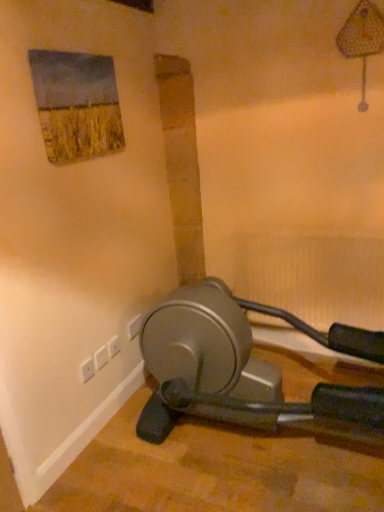
Identify the location of white plastic electric outlet at lower left, which is the first electric outlet in front-to-back order. (x=87, y=370).

Measure the distance between white plastic electric outlet at lower left, which appears as the 3th electric outlet when viewed from the front, and camera.

white plastic electric outlet at lower left, which appears as the 3th electric outlet when viewed from the front, is 2.07 meters from camera.

Locate an element on the screen. white plastic electric outlet at lower left, positioned as the 2th electric outlet in front-to-back order is located at coordinates (114, 346).

From a real-world perspective, is white plastic electric outlet at lower left, acting as the 1th electric outlet starting from the back, positioned above or below white plastic electric outlet at lower left, the first electric outlet when ordered from left to right?

Clearly, from a real-world perspective, white plastic electric outlet at lower left, acting as the 1th electric outlet starting from the back, is below white plastic electric outlet at lower left, the first electric outlet when ordered from left to right.

Are white plastic electric outlet at lower left, arranged as the 3th electric outlet when viewed from the left, and white plastic electric outlet at lower left, the 3th electric outlet positioned from the back, making contact?

No, white plastic electric outlet at lower left, arranged as the 3th electric outlet when viewed from the left, is not touching white plastic electric outlet at lower left, the 3th electric outlet positioned from the back.

Which object is closer to the camera taking this photo, white plastic electric outlet at lower left, arranged as the 3th electric outlet when viewed from the left, or white plastic electric outlet at lower left, the 3th electric outlet positioned from the back?

white plastic electric outlet at lower left, the 3th electric outlet positioned from the back.

Which is more to the right, white plastic electric outlet at lower left, arranged as the 3th electric outlet when viewed from the left, or white plastic electric outlet at lower left, the first electric outlet when ordered from left to right?

From the viewer's perspective, white plastic electric outlet at lower left, arranged as the 3th electric outlet when viewed from the left, appears more on the right side.

From a real-world perspective, who is located higher, white plastic electric outlet at lower left, acting as the 1th electric outlet starting from the back, or white plastic electric outlet at lower left, positioned as the 2th electric outlet in front-to-back order?

white plastic electric outlet at lower left, positioned as the 2th electric outlet in front-to-back order, from a real-world perspective.

Is white plastic electric outlet at lower left, positioned as the 2th electric outlet in front-to-back order, inside white plastic electric outlet at lower left, acting as the 1th electric outlet starting from the back?

That's incorrect, white plastic electric outlet at lower left, positioned as the 2th electric outlet in front-to-back order, is not inside white plastic electric outlet at lower left, acting as the 1th electric outlet starting from the back.

Where is `the 2nd electric outlet directly above the white plastic electric outlet at lower left, which appears as the 3th electric outlet when viewed from the front (from a real-world perspective)`? the 2nd electric outlet directly above the white plastic electric outlet at lower left, which appears as the 3th electric outlet when viewed from the front (from a real-world perspective) is located at coordinates (114, 346).

Considering the sizes of white plastic electric outlet at lower left, acting as the 1th electric outlet starting from the back, and white plastic electric outlet at lower left, marked as the 2th electric outlet in a right-to-left arrangement, in the image, is white plastic electric outlet at lower left, acting as the 1th electric outlet starting from the back, taller or shorter than white plastic electric outlet at lower left, marked as the 2th electric outlet in a right-to-left arrangement,?

Considering their sizes, white plastic electric outlet at lower left, acting as the 1th electric outlet starting from the back, has more height than white plastic electric outlet at lower left, marked as the 2th electric outlet in a right-to-left arrangement.

Who is shorter, white plastic plug at lower left or white plastic electric outlet at lower left, acting as the 1th electric outlet starting from the back?

Standing shorter between the two is white plastic plug at lower left.

Can you tell me how much white plastic plug at lower left and white plastic electric outlet at lower left, acting as the 1th electric outlet starting from the back, differ in facing direction?

The angle between the facing direction of white plastic plug at lower left and the facing direction of white plastic electric outlet at lower left, acting as the 1th electric outlet starting from the back, is 0.0434 degrees.

Is point (99, 350) less distant than point (142, 315)?

Yes, it is in front of point (142, 315).

Could you tell me if white plastic electric outlet at lower left, the second electric outlet in the back-to-front sequence, is turned towards white plastic plug at lower left?

No, white plastic electric outlet at lower left, the second electric outlet in the back-to-front sequence, is not aimed at white plastic plug at lower left.

Find the location of `plug in front of the white plastic electric outlet at lower left, positioned as the 2th electric outlet in front-to-back order`. plug in front of the white plastic electric outlet at lower left, positioned as the 2th electric outlet in front-to-back order is located at coordinates (101, 357).

Who is shorter, white plastic electric outlet at lower left, marked as the 2th electric outlet in a right-to-left arrangement, or white plastic plug at lower left?

white plastic electric outlet at lower left, marked as the 2th electric outlet in a right-to-left arrangement, is shorter.

Which is more to the right, white plastic electric outlet at lower left, positioned as the 2th electric outlet in front-to-back order, or white plastic plug at lower left?

white plastic electric outlet at lower left, positioned as the 2th electric outlet in front-to-back order, is more to the right.

From a real-world perspective, is white plastic electric outlet at lower left, the third electric outlet positioned from the right, positioned under white plastic electric outlet at lower left, arranged as the 1th electric outlet when viewed from the right, based on gravity?

No, from a real-world perspective, white plastic electric outlet at lower left, the third electric outlet positioned from the right, is not beneath white plastic electric outlet at lower left, arranged as the 1th electric outlet when viewed from the right.

Is point (83, 378) closer to viewer compared to point (133, 331)?

That is True.

Is white plastic electric outlet at lower left, the 3th electric outlet positioned from the back, inside the boundaries of white plastic electric outlet at lower left, arranged as the 3th electric outlet when viewed from the left, or outside?

The correct answer is: outside.

Is white plastic plug at lower left further to the viewer compared to white plastic electric outlet at lower left, marked as the 2th electric outlet in a right-to-left arrangement?

That is False.

Is white plastic plug at lower left turned away from white plastic electric outlet at lower left, positioned as the 2th electric outlet in front-to-back order?

That's not correct — white plastic plug at lower left is not looking away from white plastic electric outlet at lower left, positioned as the 2th electric outlet in front-to-back order.

Do you think white plastic plug at lower left is within white plastic electric outlet at lower left, which ranks as the 2th electric outlet in left-to-right order, or outside of it?

white plastic plug at lower left exists outside the volume of white plastic electric outlet at lower left, which ranks as the 2th electric outlet in left-to-right order.

Considering the positions of points (108, 359) and (91, 372), is point (108, 359) farther from camera compared to point (91, 372)?

Yes, point (108, 359) is farther from viewer.

Are white plastic plug at lower left and white plastic electric outlet at lower left, the third electric outlet positioned from the right, far apart?

No.

Does white plastic plug at lower left have a larger size compared to white plastic electric outlet at lower left, the third electric outlet positioned from the right?

Yes.

Is white plastic plug at lower left positioned beyond the bounds of white plastic electric outlet at lower left, the first electric outlet when ordered from left to right?

Yes.

From the white plastic electric outlet at lower left, the third electric outlet positioned from the right, count 2nd electric outlets backward and point to it. Please provide its 2D coordinates.

[(134, 326)]

From the image's perspective, starting from the white plastic electric outlet at lower left, arranged as the 1th electric outlet when viewed from the right, which electric outlet is the 1st one below? Please provide its 2D coordinates.

[(114, 346)]

In the scene shown: Estimate the real-world distances between objects in this image. Which object is further from white plastic electric outlet at lower left, which appears as the 3th electric outlet when viewed from the front, white plastic electric outlet at lower left, marked as the 2th electric outlet in a right-to-left arrangement, or white plastic electric outlet at lower left, the third electric outlet positioned from the right?

Based on the image, white plastic electric outlet at lower left, the third electric outlet positioned from the right, appears to be further to white plastic electric outlet at lower left, which appears as the 3th electric outlet when viewed from the front.

Considering their positions, is white plastic electric outlet at lower left, the first electric outlet when ordered from left to right, positioned closer to white plastic electric outlet at lower left, acting as the 1th electric outlet starting from the back, than white plastic electric outlet at lower left, marked as the 2th electric outlet in a right-to-left arrangement?

white plastic electric outlet at lower left, marked as the 2th electric outlet in a right-to-left arrangement.

Estimate the real-world distances between objects in this image. Which object is closer to white plastic plug at lower left, white plastic electric outlet at lower left, arranged as the 3th electric outlet when viewed from the left, or white plastic electric outlet at lower left, which is the first electric outlet in front-to-back order?

The object closer to white plastic plug at lower left is white plastic electric outlet at lower left, which is the first electric outlet in front-to-back order.

Estimate the real-world distances between objects in this image. Which object is closer to white plastic plug at lower left, white plastic electric outlet at lower left, marked as the 2th electric outlet in a right-to-left arrangement, or white plastic electric outlet at lower left, the 3th electric outlet positioned from the back?

white plastic electric outlet at lower left, marked as the 2th electric outlet in a right-to-left arrangement, lies closer to white plastic plug at lower left than the other object.

Which object lies further to the anchor point white plastic electric outlet at lower left, which is the first electric outlet in front-to-back order, white plastic electric outlet at lower left, acting as the 1th electric outlet starting from the back, or white plastic electric outlet at lower left, the second electric outlet in the back-to-front sequence?

Among the two, white plastic electric outlet at lower left, acting as the 1th electric outlet starting from the back, is located further to white plastic electric outlet at lower left, which is the first electric outlet in front-to-back order.

Based on their spatial positions, is white plastic electric outlet at lower left, marked as the 2th electric outlet in a right-to-left arrangement, or white plastic plug at lower left further from white plastic electric outlet at lower left, arranged as the 1th electric outlet when viewed from the right?

Among the two, white plastic plug at lower left is located further to white plastic electric outlet at lower left, arranged as the 1th electric outlet when viewed from the right.

When comparing their distances from white plastic electric outlet at lower left, which appears as the 3th electric outlet when viewed from the front, does white plastic electric outlet at lower left, which is the first electric outlet in front-to-back order, or white plastic plug at lower left seem closer?

white plastic plug at lower left.

From the picture: Considering their positions, is white plastic electric outlet at lower left, which ranks as the 2th electric outlet in left-to-right order, positioned further to white plastic electric outlet at lower left, the first electric outlet when ordered from left to right, than white plastic plug at lower left?

The object further to white plastic electric outlet at lower left, the first electric outlet when ordered from left to right, is white plastic electric outlet at lower left, which ranks as the 2th electric outlet in left-to-right order.

You are a GUI agent. You are given a task and a screenshot of the screen. Output one action in this format:
    pyautogui.click(x=<x>, y=<y>)
    Task: Click on the plug positioned between white plastic electric outlet at lower left, which is the first electric outlet in front-to-back order, and white plastic electric outlet at lower left, which appears as the 3th electric outlet when viewed from the front, from near to far
    The height and width of the screenshot is (512, 384).
    Given the screenshot: What is the action you would take?
    pyautogui.click(x=101, y=357)

The width and height of the screenshot is (384, 512). I want to click on electric outlet positioned between white plastic electric outlet at lower left, the first electric outlet when ordered from left to right, and white plastic electric outlet at lower left, arranged as the 3th electric outlet when viewed from the left, from near to far, so click(114, 346).

Identify the location of plug between white plastic electric outlet at lower left, the third electric outlet positioned from the right, and white plastic electric outlet at lower left, marked as the 2th electric outlet in a right-to-left arrangement, in the front-back direction. (101, 357).

Locate an element on the screen. electric outlet located between white plastic plug at lower left and white plastic electric outlet at lower left, arranged as the 1th electric outlet when viewed from the right, in the depth direction is located at coordinates coord(114,346).